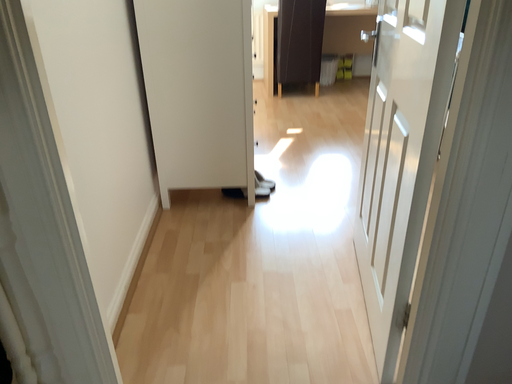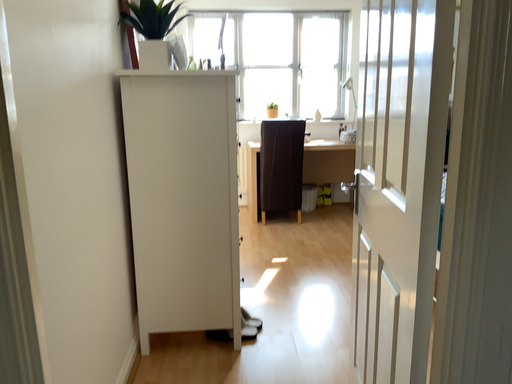
Question: How did the camera likely rotate when shooting the video?

Choices:
 (A) rotated downward
 (B) rotated upward

Answer: (B)